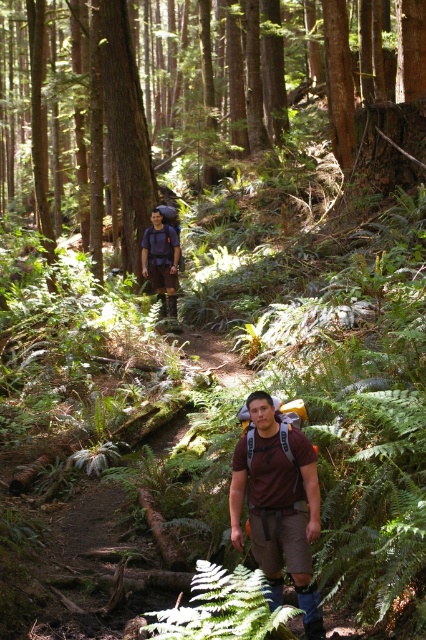
You are a hiker trying to navigate through the forest. You need to locate the smooth brown tree trunk at upper center. According to the map, the tree is at coordinates point 0.203, 0.298. Can you determine if the tree is positioned in the upper half of the image?

The smooth brown tree trunk at upper center is located at point 0.298 on the vertical axis. Since the upper half of the image would be from 0 to 0.5, the tree is indeed positioned in the upper half of the image.